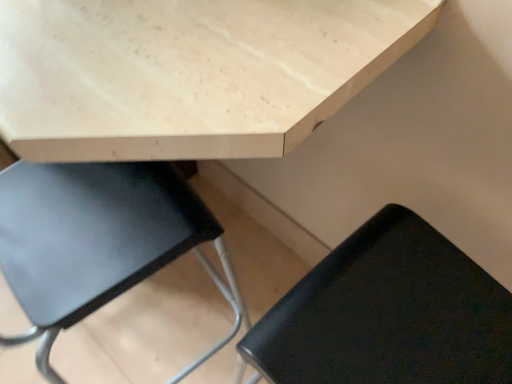
This screenshot has height=384, width=512. What do you see at coordinates (97, 241) in the screenshot?
I see `black leather chair at lower left` at bounding box center [97, 241].

The height and width of the screenshot is (384, 512). In order to click on black leather chair at lower left in this screenshot , I will do `click(97, 241)`.

Where is `black leather chair at lower left`? The image size is (512, 384). black leather chair at lower left is located at coordinates (97, 241).